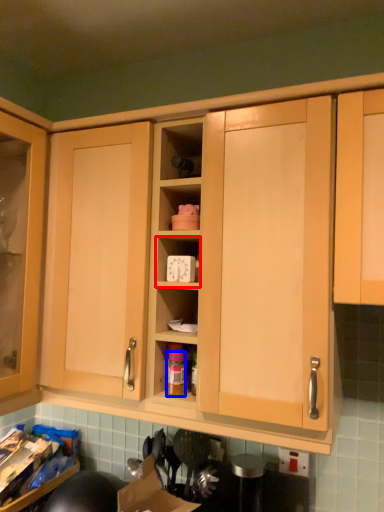
Question: Which object is closer to the camera taking this photo, cabinet (highlighted by a red box) or bottle (highlighted by a blue box)?

Choices:
 (A) cabinet
 (B) bottle

Answer: (A)